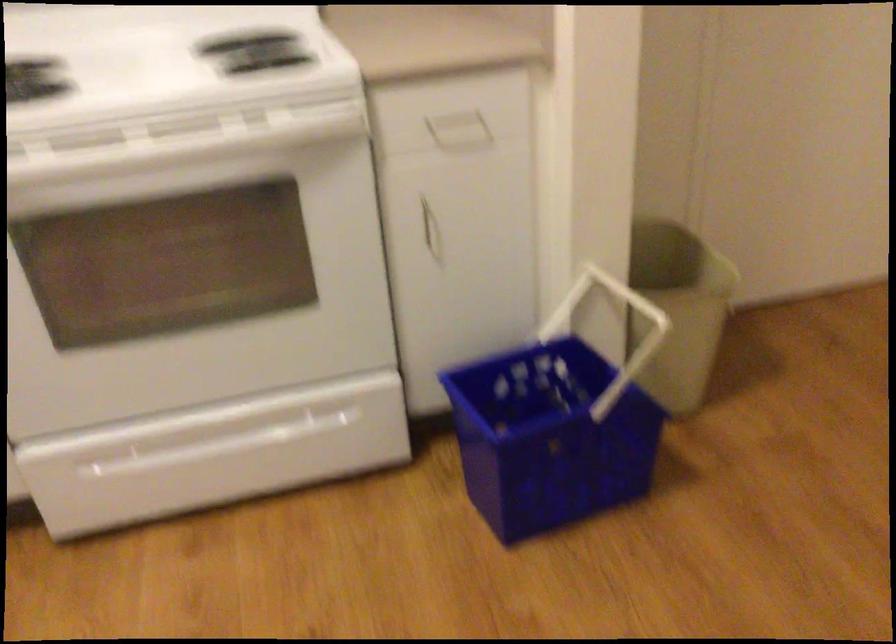
What do you see at coordinates (175, 143) in the screenshot?
I see `the oven door handle` at bounding box center [175, 143].